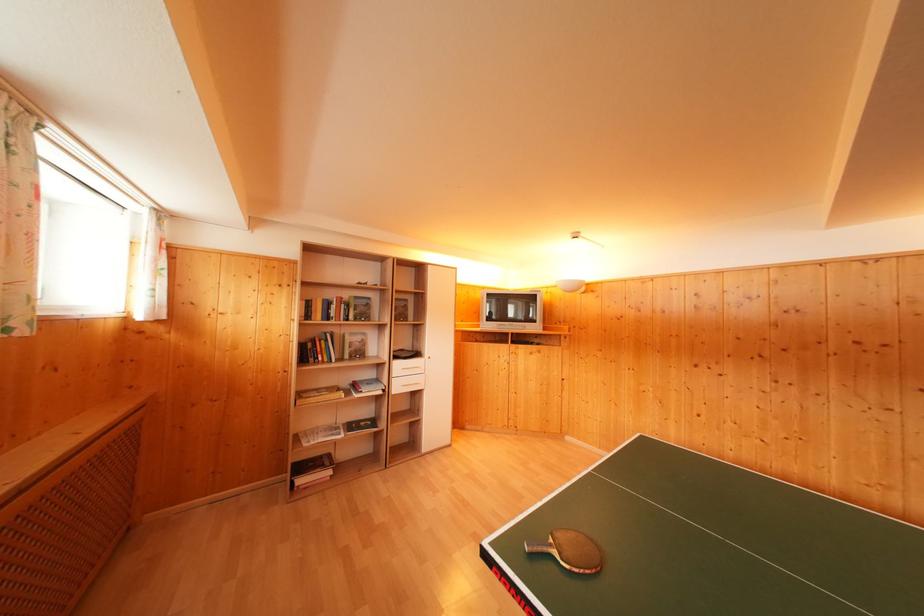
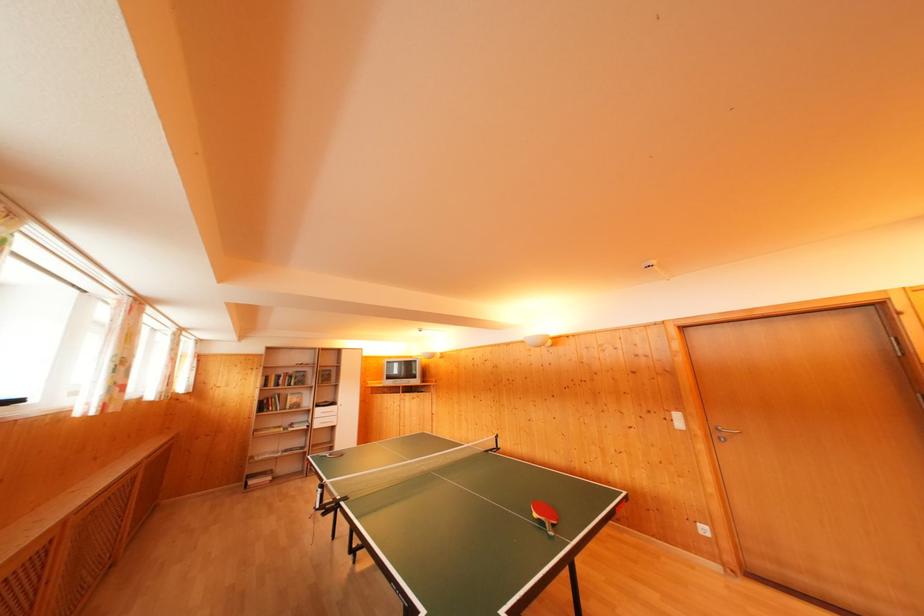
Locate, in the second image, the point that corresponds to [350,300] in the first image.

(296, 376)